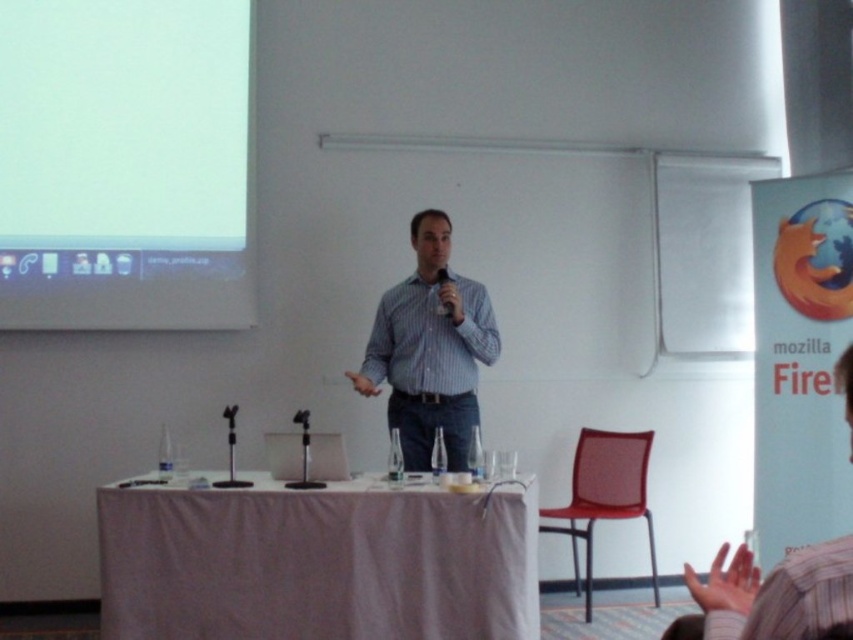
Can you confirm if blue striped shirt at center is positioned to the right of red mesh chair at lower right?

In fact, blue striped shirt at center is to the left of red mesh chair at lower right.

Between blue striped shirt at center and red mesh chair at lower right, which one appears on the left side from the viewer's perspective?

From the viewer's perspective, blue striped shirt at center appears more on the left side.

Where is `blue striped shirt at center`? blue striped shirt at center is located at coordinates (428, 349).

Image resolution: width=853 pixels, height=640 pixels. Identify the location of blue striped shirt at center. (428, 349).

Does white fabric table at lower center have a lesser height compared to red mesh chair at lower right?

Yes.

Which of these two, white fabric table at lower center or red mesh chair at lower right, stands shorter?

Standing shorter between the two is white fabric table at lower center.

Is point (387, 512) behind point (548, 515)?

No, it is in front of (548, 515).

At what (x,y) coordinates should I click in order to perform the action: click on white fabric table at lower center. Please return your answer as a coordinate pair (x, y). Image resolution: width=853 pixels, height=640 pixels. Looking at the image, I should click on (317, 563).

Does matte white shirt at center appear under red mesh chair at lower right?

Incorrect, matte white shirt at center is not positioned below red mesh chair at lower right.

Which is above, matte white shirt at center or red mesh chair at lower right?

Positioned higher is matte white shirt at center.

Which is behind, point (811, 636) or point (639, 490)?

The point (639, 490) is more distant.

You are a GUI agent. You are given a task and a screenshot of the screen. Output one action in this format:
    pyautogui.click(x=<x>, y=<y>)
    Task: Click on the matte white shirt at center
    
    Given the screenshot: What is the action you would take?
    pyautogui.click(x=773, y=595)